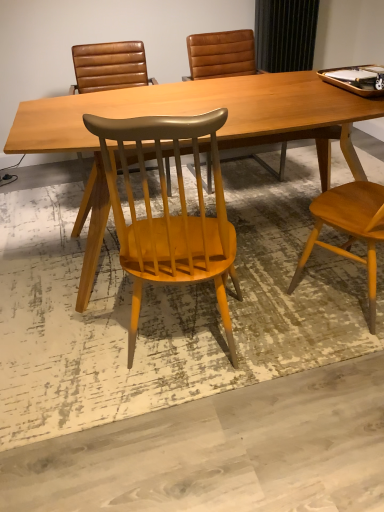
This screenshot has width=384, height=512. Identify the location of vacant space to the right of matte wood chair at center, marked as the 3th chair in a back-to-front arrangement. (286, 323).